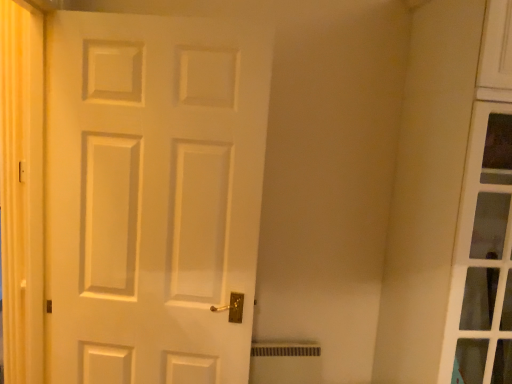
Question: Is white matte door at center completely or partially outside of yellow fabric curtain at left?

Choices:
 (A) no
 (B) yes

Answer: (B)

Question: From a real-world perspective, is white matte door at center physically above yellow fabric curtain at left?

Choices:
 (A) yes
 (B) no

Answer: (B)

Question: Considering the relative positions of white matte door at center and yellow fabric curtain at left in the image provided, is white matte door at center to the left of yellow fabric curtain at left from the viewer's perspective?

Choices:
 (A) no
 (B) yes

Answer: (A)

Question: Is white matte door at center positioned in front of yellow fabric curtain at left?

Choices:
 (A) no
 (B) yes

Answer: (A)

Question: From the image's perspective, is white matte door at center over yellow fabric curtain at left?

Choices:
 (A) yes
 (B) no

Answer: (B)

Question: From the image's perspective, would you say white matte door at center is shown under yellow fabric curtain at left?

Choices:
 (A) no
 (B) yes

Answer: (B)

Question: From a real-world perspective, is yellow fabric curtain at left under white matte door at center?

Choices:
 (A) no
 (B) yes

Answer: (A)

Question: From the image's perspective, is yellow fabric curtain at left located above white matte door at center?

Choices:
 (A) yes
 (B) no

Answer: (A)

Question: Considering the relative sizes of yellow fabric curtain at left and white matte door at center in the image provided, is yellow fabric curtain at left smaller than white matte door at center?

Choices:
 (A) yes
 (B) no

Answer: (A)

Question: Considering the relative sizes of yellow fabric curtain at left and white matte door at center in the image provided, is yellow fabric curtain at left bigger than white matte door at center?

Choices:
 (A) no
 (B) yes

Answer: (A)

Question: Can white matte door at center be found inside yellow fabric curtain at left?

Choices:
 (A) yes
 (B) no

Answer: (B)

Question: Is yellow fabric curtain at left beside white matte door at center?

Choices:
 (A) no
 (B) yes

Answer: (A)

Question: From a real-world perspective, relative to yellow fabric curtain at left, is white matte door at center vertically above or below?

Choices:
 (A) above
 (B) below

Answer: (B)